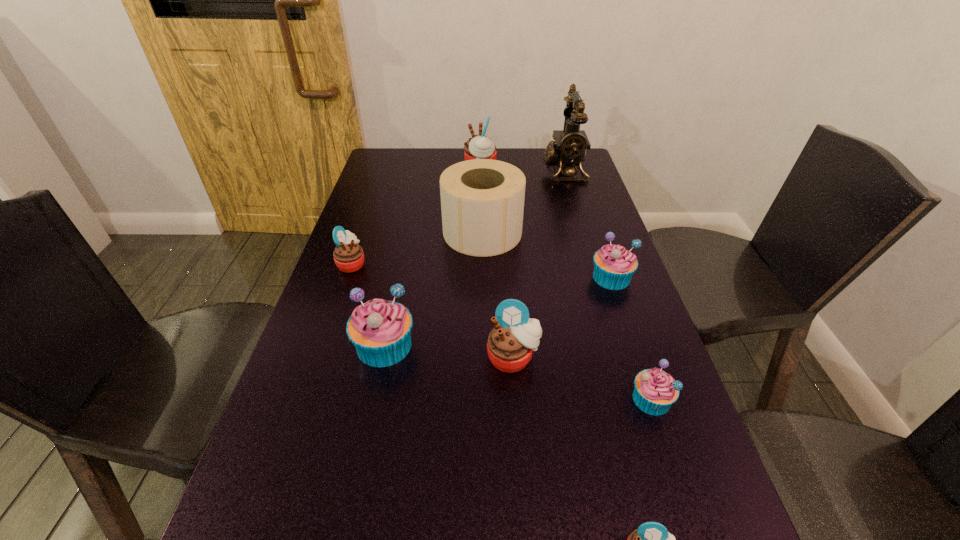
At what (x,y) coordinates should I click in order to perform the action: click on free space that satisfies the following two spatial constraints: 1. on the front-facing side of the leftmost object; 2. on the back side of the second muffin from left to right. Please return your answer as a coordinate pair (x, y). Looking at the image, I should click on (324, 346).

Image resolution: width=960 pixels, height=540 pixels. I want to click on free location that satisfies the following two spatial constraints: 1. on the front-facing side of the second farthest pink muffin; 2. on the back side of the second biggest blue muffin, so click(347, 278).